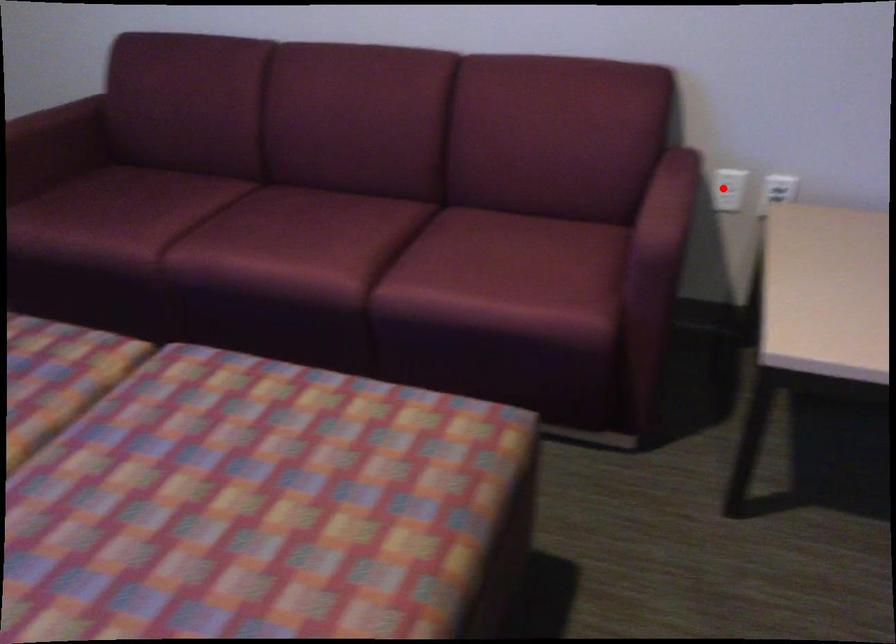
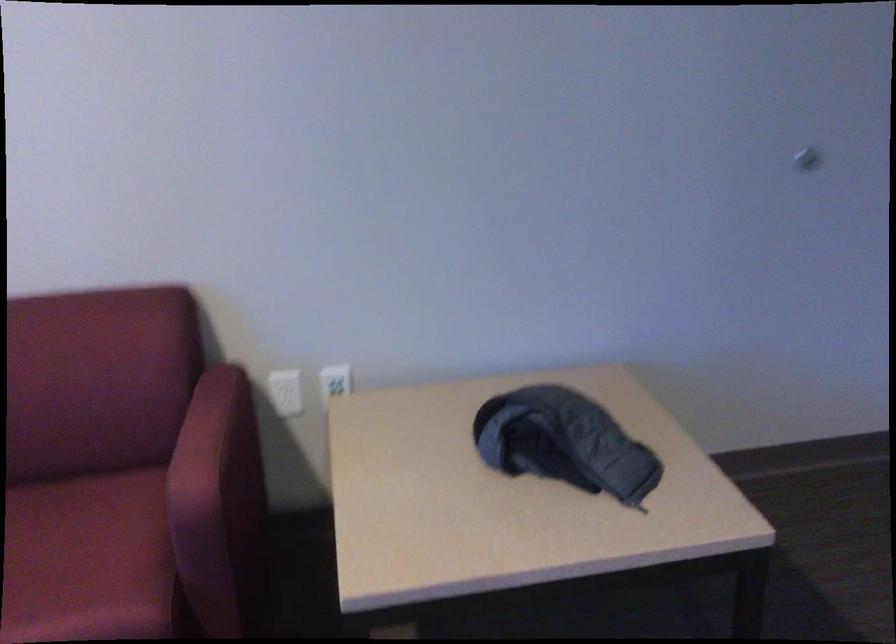
In the second image, find the point that corresponds to the highlighted location in the first image.

(286, 392)